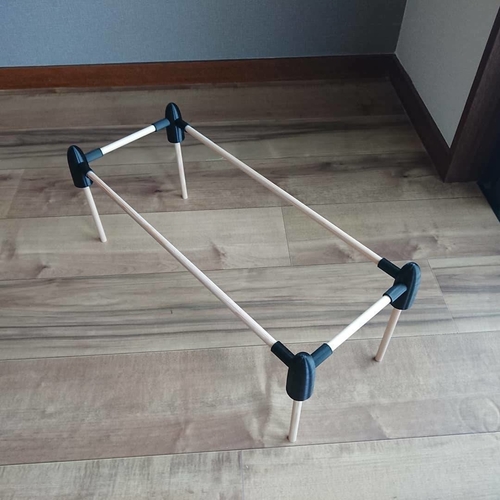
What are the coordinates of `dark floor` in the screenshot? It's located at (493, 197).